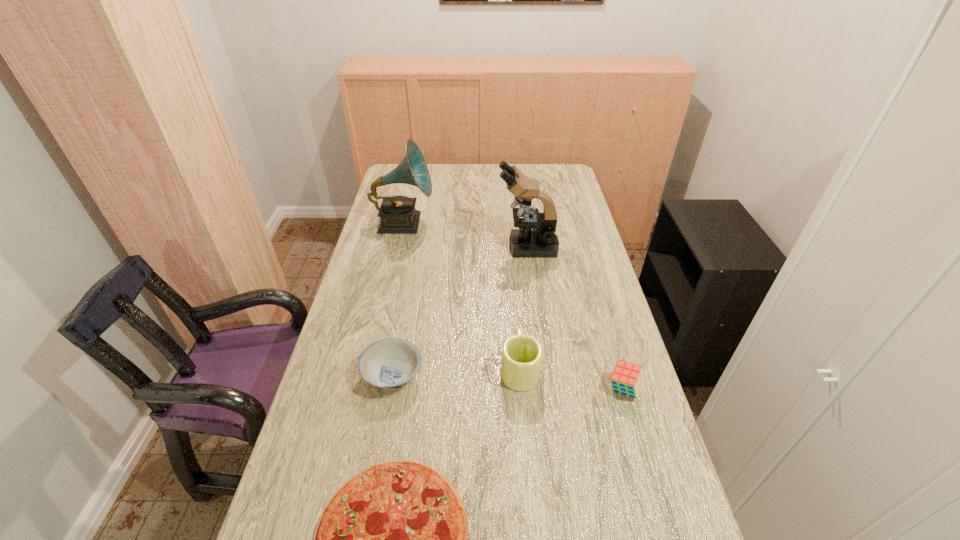
The image size is (960, 540). In order to click on vacant area that satisfies the following two spatial constraints: 1. with the handle on the side of the microscope; 2. on the right side of the fourth shortest object in this screenshot , I will do `click(510, 247)`.

Identify the location of vacant space that satisfies the following two spatial constraints: 1. on the back side of the fifth tallest object; 2. on the left side of the microscope. This screenshot has height=540, width=960. (417, 247).